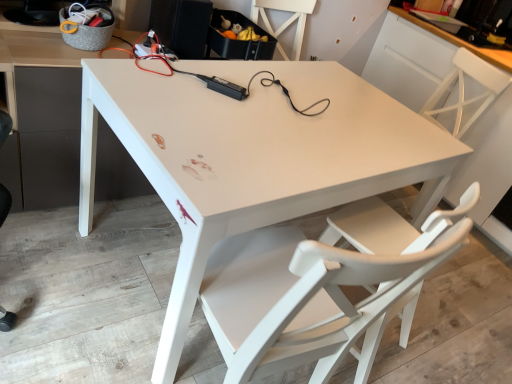
Question: Considering the relative sizes of white glossy table at center and white matte chair at upper right, which is the 1th chair in right-to-left order, in the image provided, is white glossy table at center smaller than white matte chair at upper right, which is the 1th chair in right-to-left order,?

Choices:
 (A) no
 (B) yes

Answer: (B)

Question: Considering the relative sizes of white glossy table at center and white matte chair at upper right, which is the 1th chair in right-to-left order, in the image provided, is white glossy table at center shorter than white matte chair at upper right, which is the 1th chair in right-to-left order,?

Choices:
 (A) no
 (B) yes

Answer: (B)

Question: From the image's perspective, is white glossy table at center on white matte chair at upper right, the 2th chair when ordered from front to back?

Choices:
 (A) yes
 (B) no

Answer: (B)

Question: Is white glossy table at center facing towards white matte chair at upper right, marked as the 2th chair in a left-to-right arrangement?

Choices:
 (A) no
 (B) yes

Answer: (A)

Question: Is white glossy table at center not near white matte chair at upper right, marked as the 1th chair in a back-to-front arrangement?

Choices:
 (A) no
 (B) yes

Answer: (B)

Question: From a real-world perspective, is white matte chair at upper right, marked as the 2th chair in a left-to-right arrangement, positioned above or below white matte chair at lower right, the 1th chair when ordered from front to back?

Choices:
 (A) below
 (B) above

Answer: (B)

Question: Is point (475, 64) closer or farther from the camera than point (424, 233)?

Choices:
 (A) closer
 (B) farther

Answer: (B)

Question: From the image's perspective, is white matte chair at upper right, which is the 1th chair in right-to-left order, positioned above or below white matte chair at lower right, which ranks as the second chair in back-to-front order?

Choices:
 (A) below
 (B) above

Answer: (B)

Question: In terms of height, does white matte chair at upper right, which is the 1th chair in right-to-left order, look taller or shorter compared to white matte chair at lower right, which ranks as the second chair in back-to-front order?

Choices:
 (A) short
 (B) tall

Answer: (B)

Question: Visually, is white glossy table at center positioned to the left or to the right of white matte chair at upper right, marked as the 1th chair in a back-to-front arrangement?

Choices:
 (A) right
 (B) left

Answer: (B)

Question: From the image's perspective, relative to white matte chair at upper right, the 2th chair when ordered from front to back, is white glossy table at center above or below?

Choices:
 (A) below
 (B) above

Answer: (A)

Question: From a real-world perspective, is white glossy table at center physically located above or below white matte chair at upper right, marked as the 2th chair in a left-to-right arrangement?

Choices:
 (A) above
 (B) below

Answer: (B)

Question: In terms of height, does white glossy table at center look taller or shorter compared to white matte chair at upper right, the 2th chair when ordered from front to back?

Choices:
 (A) tall
 (B) short

Answer: (B)

Question: From the image's perspective, relative to white matte chair at upper right, which is the 1th chair in right-to-left order, is white matte chair at lower right, which ranks as the second chair in back-to-front order, above or below?

Choices:
 (A) above
 (B) below

Answer: (B)

Question: Is white matte chair at lower right, which ranks as the second chair in back-to-front order, situated inside white matte chair at upper right, marked as the 2th chair in a left-to-right arrangement, or outside?

Choices:
 (A) outside
 (B) inside

Answer: (A)